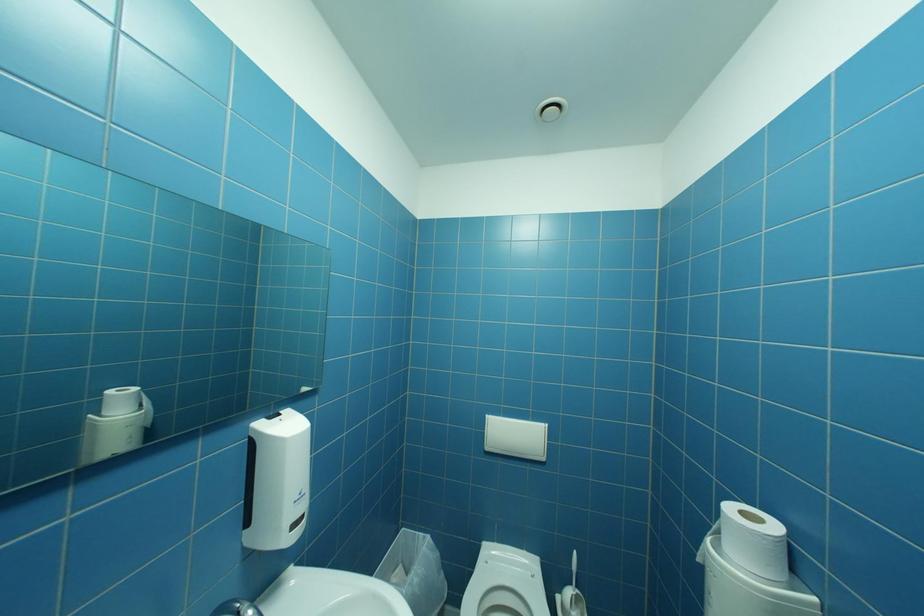
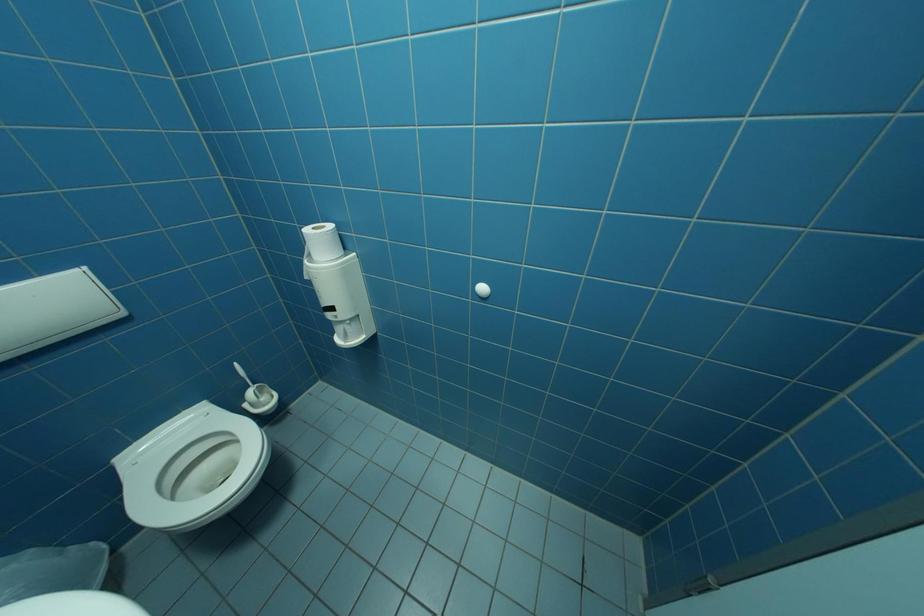
How did the camera likely rotate?

The camera's rotation is toward right-down.